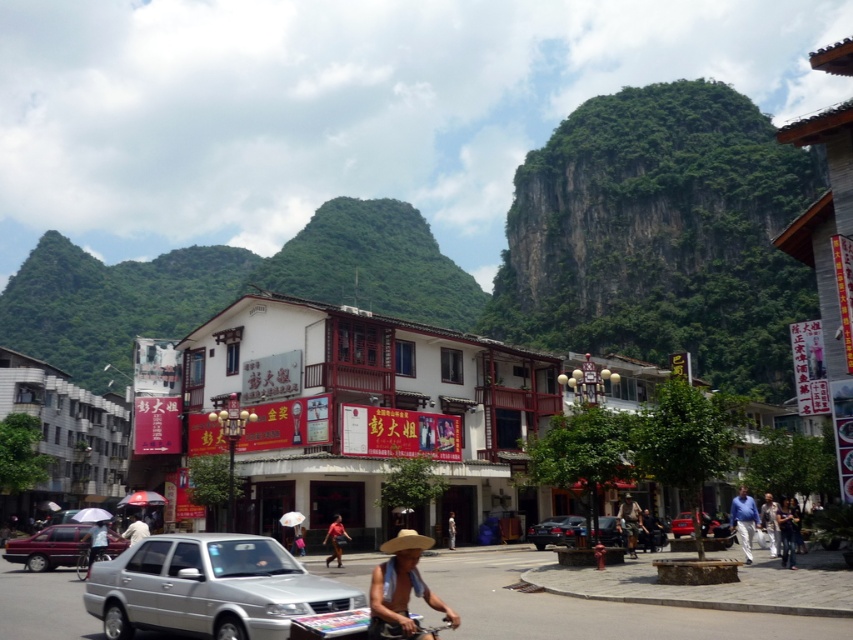
Is green rocky mountain at upper center below green leafy mountain at upper left?

Yes, green rocky mountain at upper center is below green leafy mountain at upper left.

Is green rocky mountain at upper center in front of green leafy mountain at upper left?

Yes.

The height and width of the screenshot is (640, 853). Describe the element at coordinates (660, 236) in the screenshot. I see `green rocky mountain at upper center` at that location.

Where is `green rocky mountain at upper center`? The height and width of the screenshot is (640, 853). green rocky mountain at upper center is located at coordinates (660, 236).

Which is below, green leafy mountain at upper left or light blue fabric umbrella at center?

light blue fabric umbrella at center

You are a GUI agent. You are given a task and a screenshot of the screen. Output one action in this format:
    pyautogui.click(x=<x>, y=<y>)
    Task: Click on the green leafy mountain at upper left
    This screenshot has width=853, height=640.
    Given the screenshot: What is the action you would take?
    pyautogui.click(x=228, y=285)

I want to click on green leafy mountain at upper left, so click(x=228, y=285).

Looking at this image, is denim pants at lower right closer to the viewer compared to light brown leather jacket at center?

Yes, it is.

Is denim pants at lower right below light brown leather jacket at center?

No.

Find the location of a particular element. The width and height of the screenshot is (853, 640). denim pants at lower right is located at coordinates (787, 532).